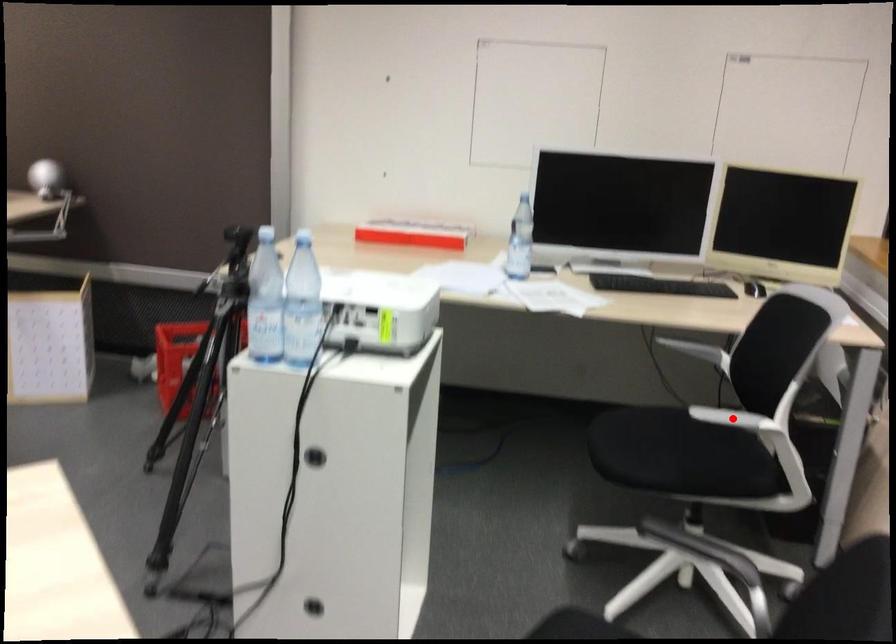
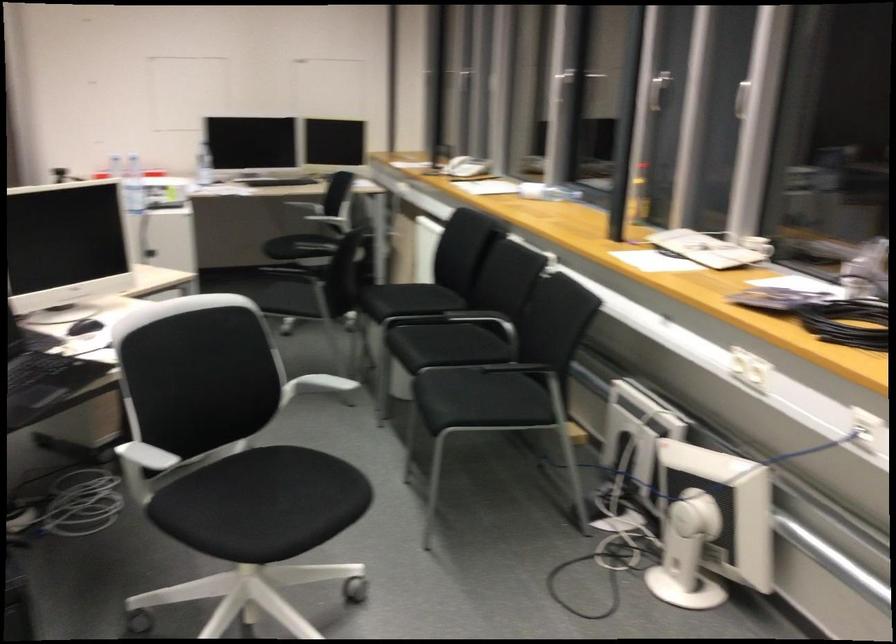
Question: I am providing you with two images of the same scene from different viewpoints. A red point is marked on the first image. Is the red point's position out of view in image 2?

Choices:
 (A) Yes
 (B) No

Answer: (A)